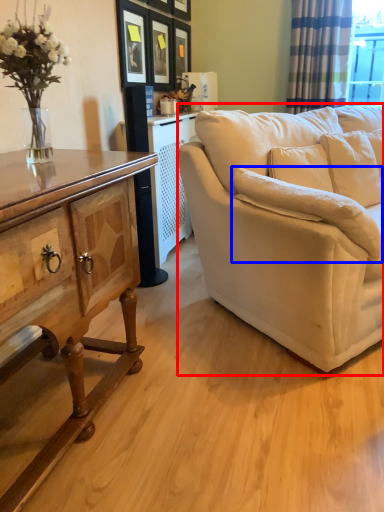
Question: Among these objects, which one is farthest to the camera, studio couch (highlighted by a red box) or pillow (highlighted by a blue box)?

Choices:
 (A) studio couch
 (B) pillow

Answer: (B)